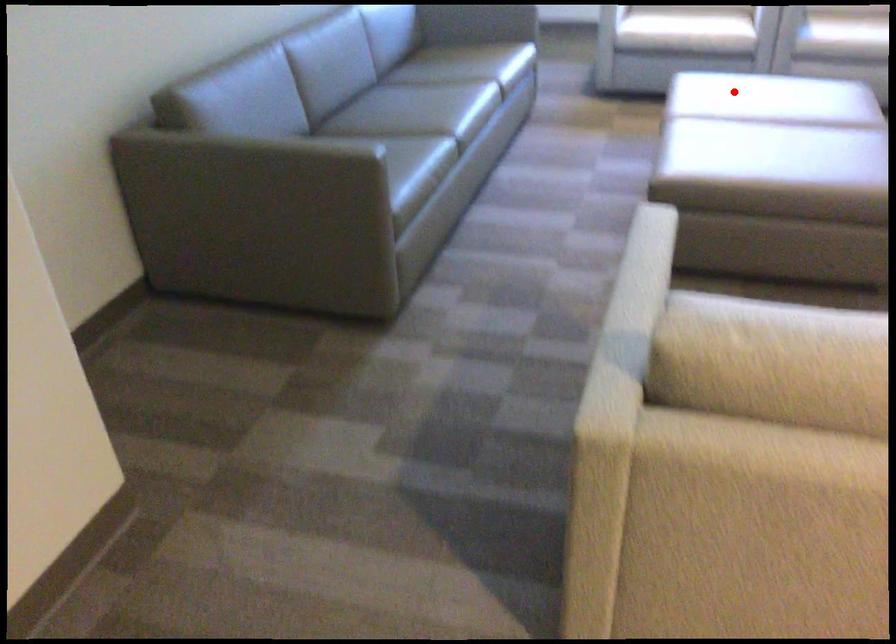
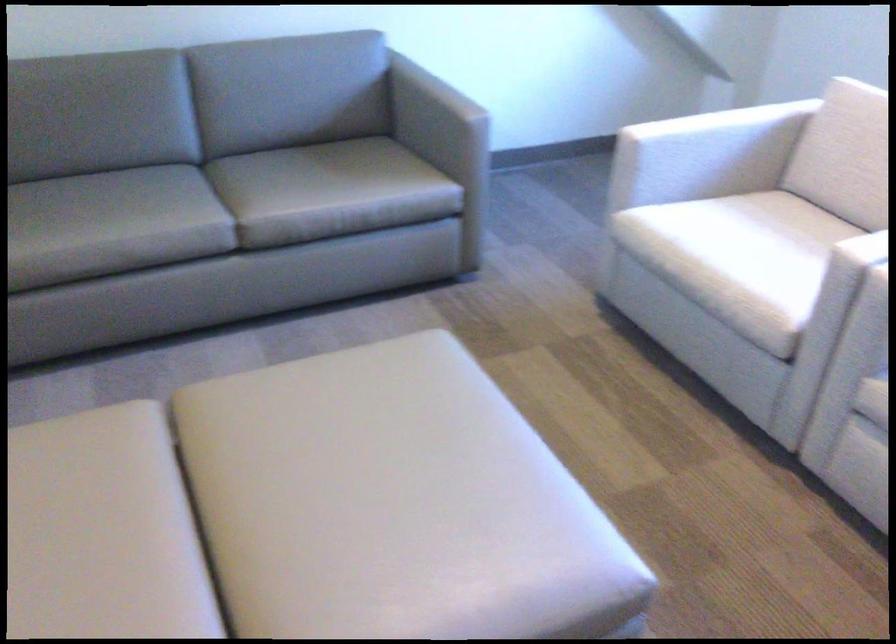
Question: I am providing you with two images of the same scene from different viewpoints. A red point is shown in image1. For the corresponding object point in image2, is it positioned nearer or farther from the camera?

Choices:
 (A) Nearer
 (B) Farther

Answer: (A)